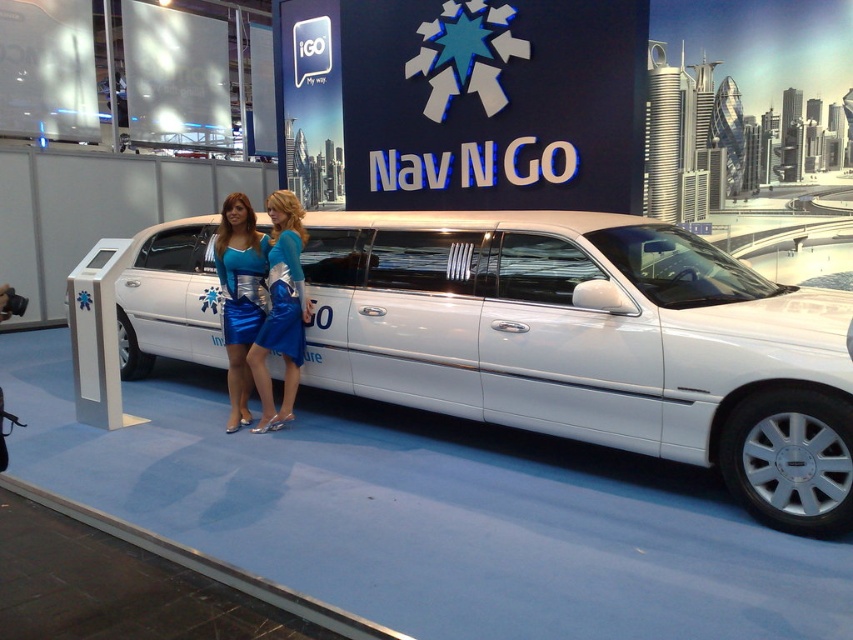
Question: Is white metallic sedan at center wider than blue satin dress at center?

Choices:
 (A) yes
 (B) no

Answer: (A)

Question: Considering the real-world distances, which object is closest to the shiny blue dress at center?

Choices:
 (A) white metallic sedan at center
 (B) blue satin dress at center

Answer: (B)

Question: Can you confirm if white metallic sedan at center is positioned to the right of shiny blue dress at center?

Choices:
 (A) yes
 (B) no

Answer: (A)

Question: Which of the following is the farthest from the observer?

Choices:
 (A) (238, 310)
 (B) (468, 282)
 (C) (296, 268)

Answer: (A)

Question: Considering the real-world distances, which object is closest to the blue satin dress at center?

Choices:
 (A) white metallic sedan at center
 (B) shiny blue dress at center

Answer: (B)

Question: Considering the relative positions of blue satin dress at center and shiny blue dress at center in the image provided, where is blue satin dress at center located with respect to shiny blue dress at center?

Choices:
 (A) left
 (B) right

Answer: (B)